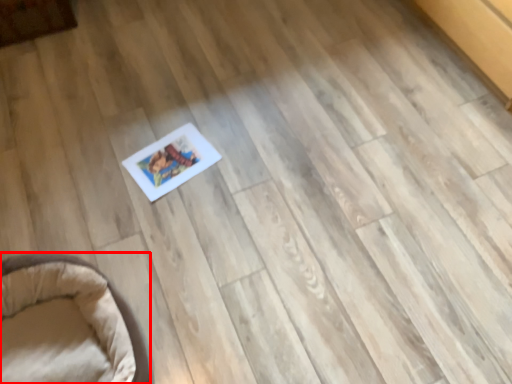
Question: From the image's perspective, what is the correct spatial positioning of furniture (annotated by the red box) in reference to furniture?

Choices:
 (A) above
 (B) below

Answer: (B)